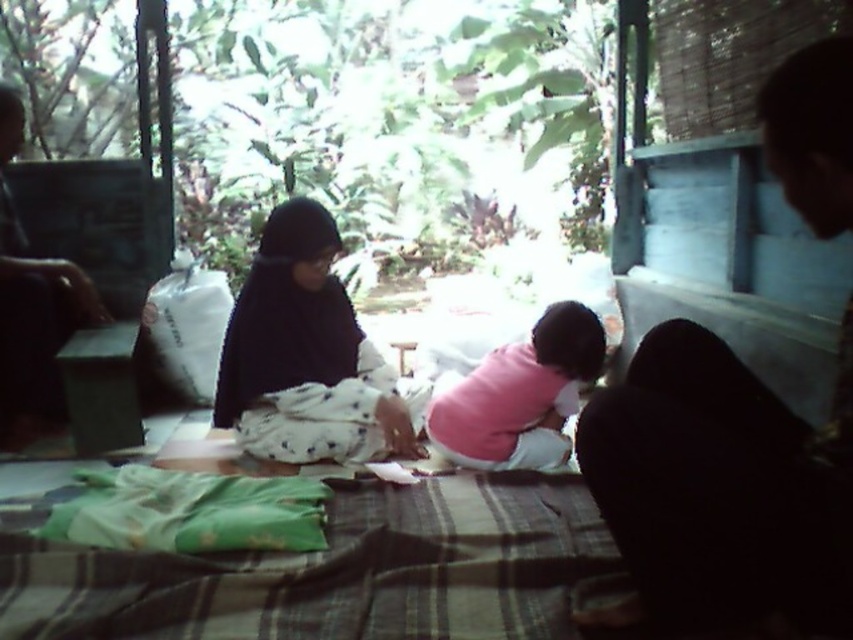
Which of these two, green plaid blanket at lower center or black fabric at right, stands taller?

black fabric at right

Between green plaid blanket at lower center and black fabric at right, which one is positioned lower?

green plaid blanket at lower center is below.

At what (x,y) coordinates should I click in order to perform the action: click on green plaid blanket at lower center. Please return your answer as a coordinate pair (x, y). This screenshot has width=853, height=640. Looking at the image, I should click on (337, 572).

Is black fabric at right taller than pink soft fabric baby at center?

Indeed, black fabric at right has a greater height compared to pink soft fabric baby at center.

Measure the distance between black fabric at right and camera.

black fabric at right and camera are 38.95 inches apart.

This screenshot has height=640, width=853. I want to click on black fabric at right, so click(712, 492).

Does black fabric at center have a greater height compared to pink soft fabric baby at center?

Yes, black fabric at center is taller than pink soft fabric baby at center.

Between point (236, 364) and point (550, 406), which one is positioned behind?

The point (550, 406) is behind.

This screenshot has height=640, width=853. What do you see at coordinates (306, 355) in the screenshot?
I see `black fabric at center` at bounding box center [306, 355].

Find the location of a particular element. The height and width of the screenshot is (640, 853). black fabric at center is located at coordinates (306, 355).